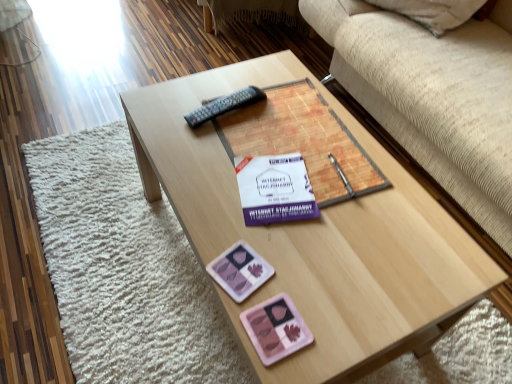
What are the coordinates of `free space in front of matte paper book at center` in the screenshot? It's located at [x=321, y=259].